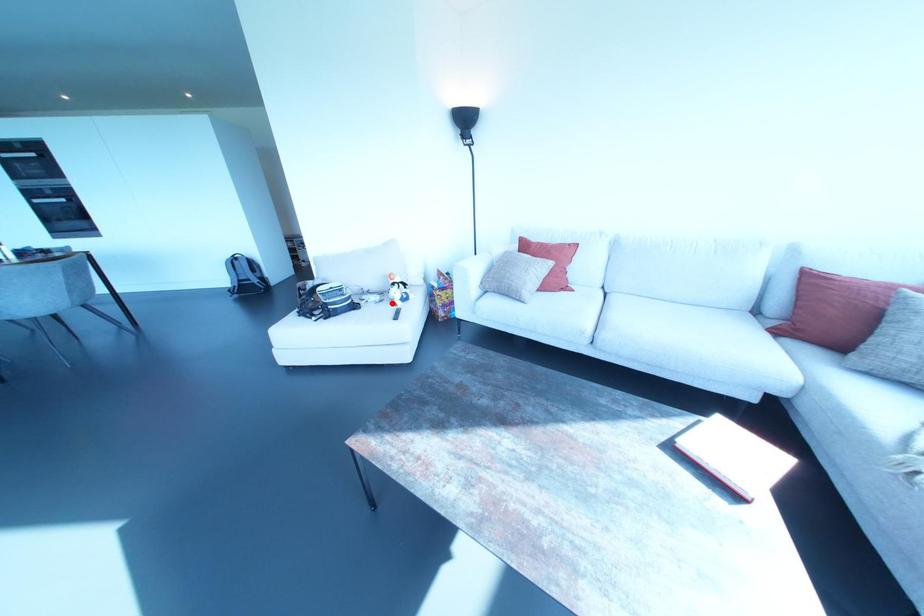
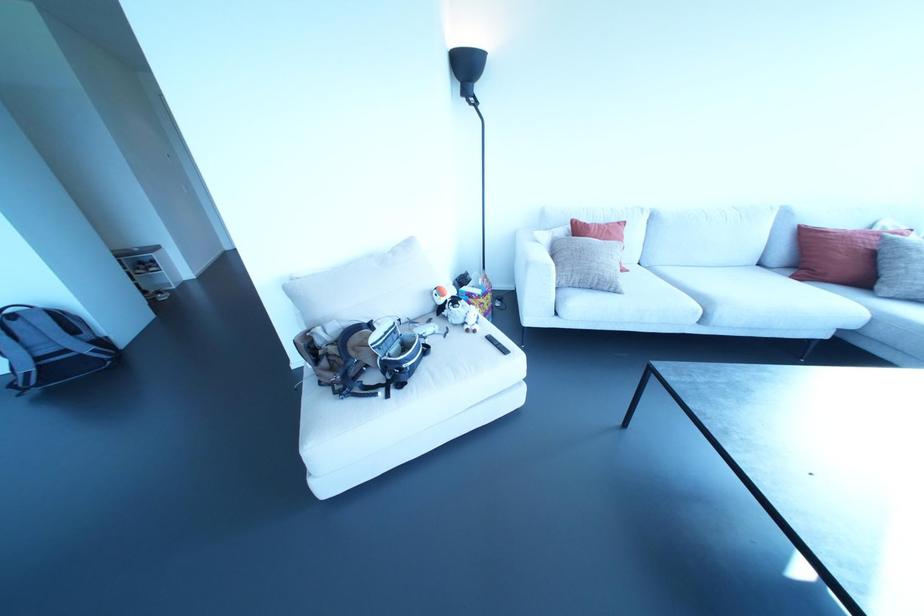
Question: I am providing you with two images of the same scene from different viewpoints. A red point is marked on the first image. Is the red point's position out of view in image 2?

Choices:
 (A) Yes
 (B) No

Answer: (B)